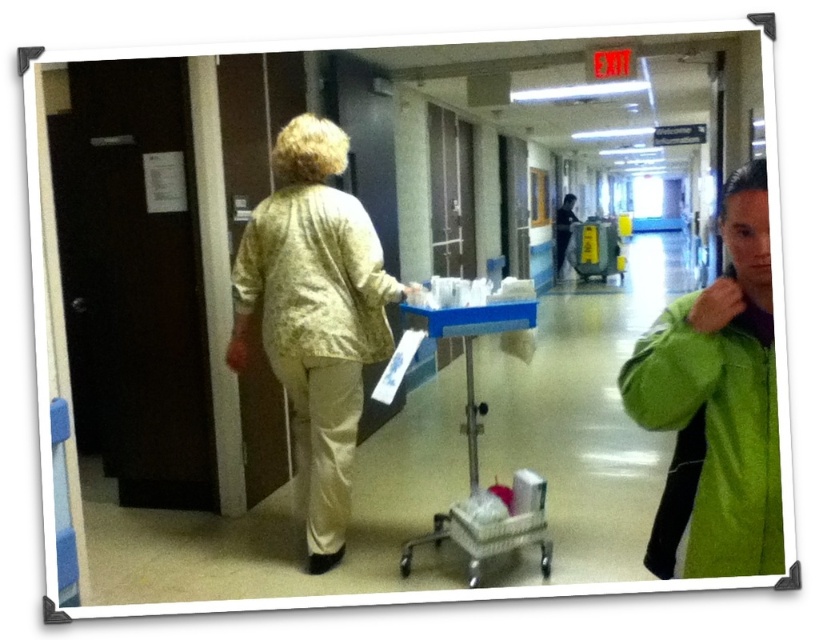
Question: Which of these objects is positioned farthest from the green fleece jacket at right?

Choices:
 (A) fluffy beige jacket at center
 (B) metallic blue trolley at center
 (C) floral fabric jacket at center

Answer: (C)

Question: Is floral fabric jacket at center closer to the viewer compared to metallic blue trolley at center?

Choices:
 (A) yes
 (B) no

Answer: (B)

Question: Considering the relative positions of floral fabric jacket at center and fluffy beige jacket at center in the image provided, where is floral fabric jacket at center located with respect to fluffy beige jacket at center?

Choices:
 (A) left
 (B) right

Answer: (A)

Question: In this image, where is green fleece jacket at right located relative to fluffy beige jacket at center?

Choices:
 (A) below
 (B) above

Answer: (A)

Question: Which of these objects is positioned closest to the green fleece jacket at right?

Choices:
 (A) floral fabric jacket at center
 (B) fluffy beige jacket at center

Answer: (B)

Question: Considering the real-world distances, which object is farthest from the green fleece jacket at right?

Choices:
 (A) metallic blue trolley at center
 (B) fluffy beige jacket at center

Answer: (B)